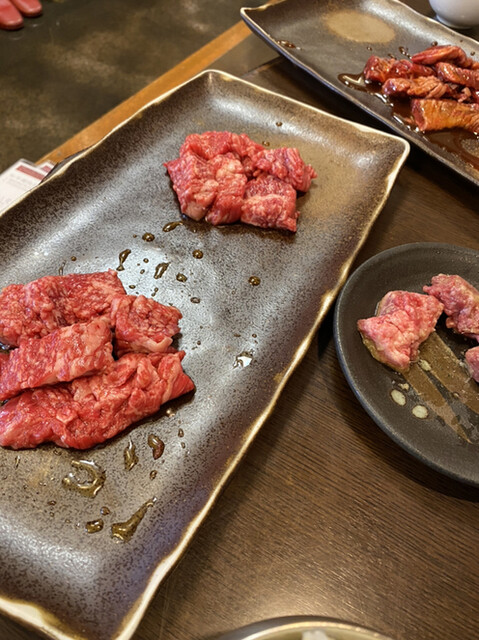
Locate an element on the screen. gold edge around platter is located at coordinates (303, 342).